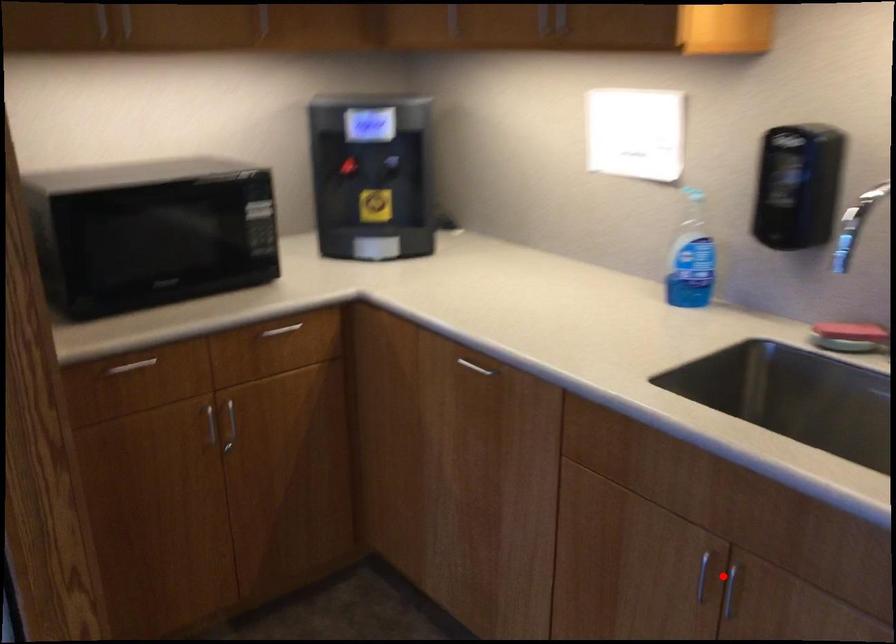
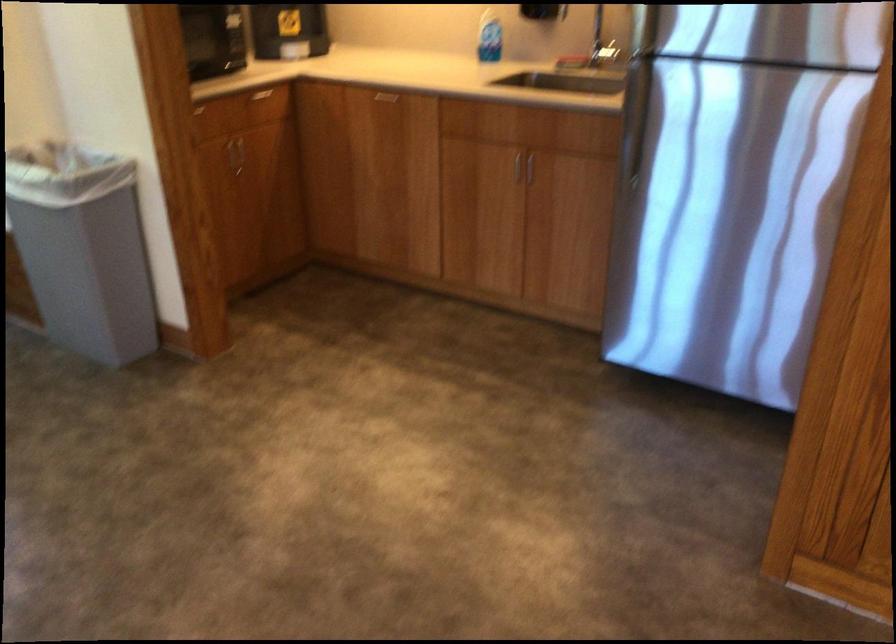
The point at the highlighted location is marked in the first image. Where is the corresponding point in the second image?

(524, 166)